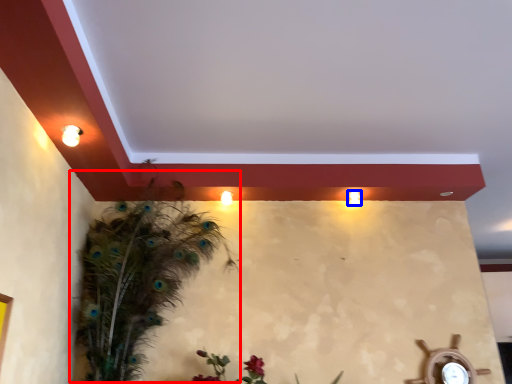
Question: Among these objects, which one is farthest to the camera, bird (highlighted by a red box) or light (highlighted by a blue box)?

Choices:
 (A) bird
 (B) light

Answer: (B)